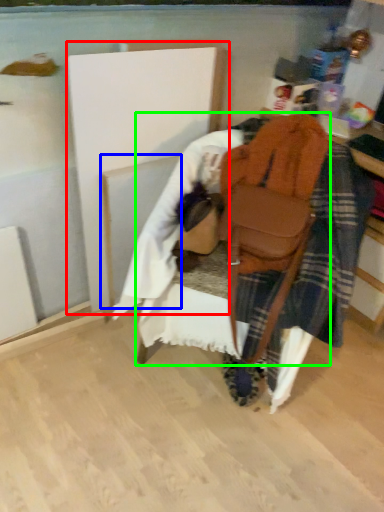
Question: Based on their relative distances, which object is nearer to wood (highlighted by a red box)? Choose from wood (highlighted by a blue box) and furniture (highlighted by a green box).

Choices:
 (A) wood
 (B) furniture

Answer: (A)